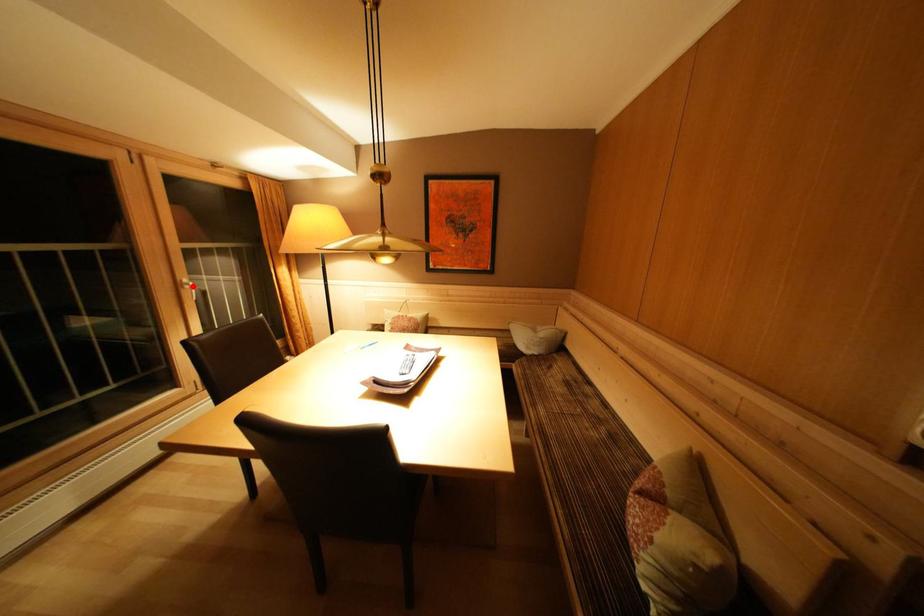
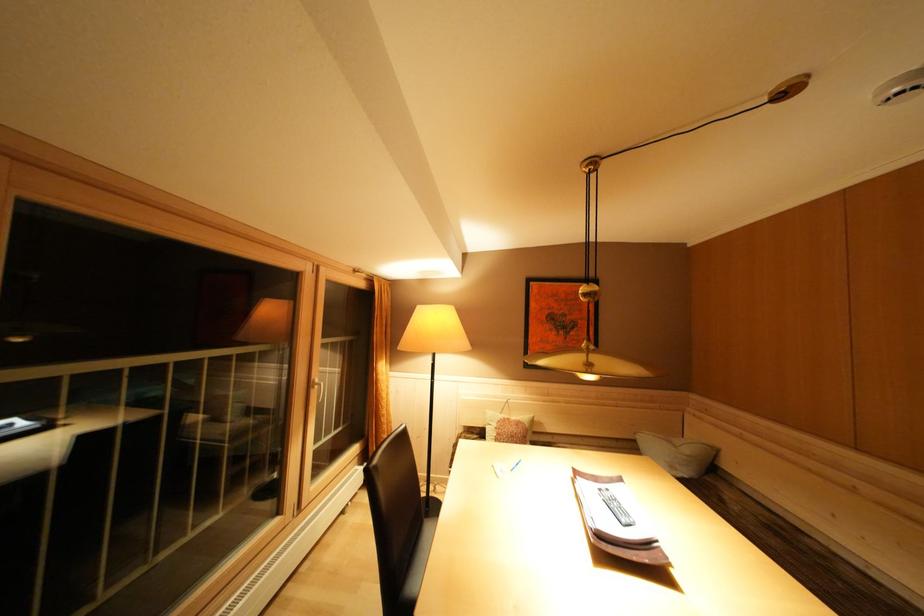
The point at the highlighted location is marked in the first image. Where is the corresponding point in the second image?

(323, 386)